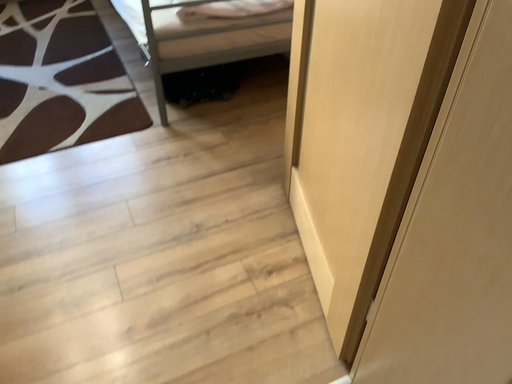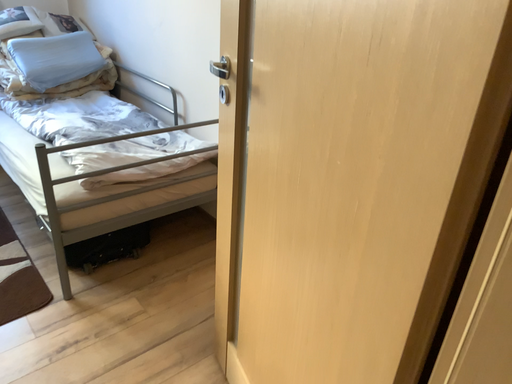
Question: How did the camera likely rotate when shooting the video?

Choices:
 (A) rotated right
 (B) rotated left

Answer: (A)